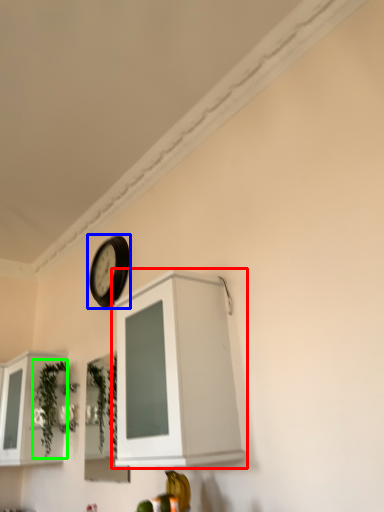
Question: Estimate the real-world distances between objects in this image. Which object is closer to cabinetry (highlighted by a red box), clock (highlighted by a blue box) or plant (highlighted by a green box)?

Choices:
 (A) clock
 (B) plant

Answer: (A)